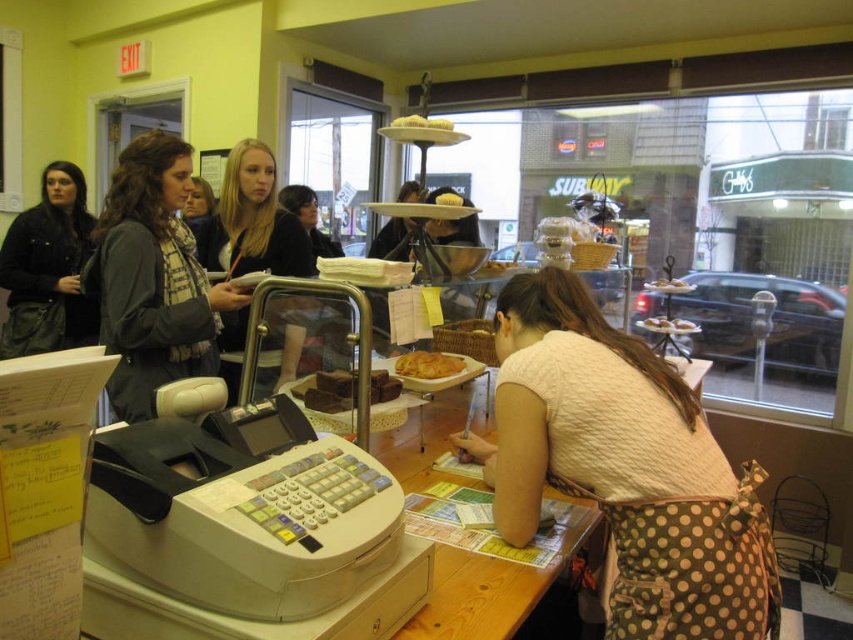
You are a customer standing at the checkout counter in the bakery scene. You notice two items hanging on a rack behind the counter. Which item is closer to your left side, the matte black jacket at left or the matte black scarf at center?

The matte black jacket at left is closer to your left side because it is positioned on the left side of the matte black scarf at center.

You are a customer at the bakery and want to pick up an item from the counter. The matte black jacket at left and the matte black scarf at center are in your way. Which object should you move first to clear the path?

The matte black scarf at center is behind the matte black jacket at left, so you should move the matte black jacket at left first to clear the path.

You are a customer at the bakery and want to buy the golden brown flaky pastry at center. However, there is a matte black scarf at center blocking your view of the pastry. Can you see the pastry clearly from where you are standing?

The matte black scarf at center is taller than the golden brown flaky pastry at center, so the scarf is blocking your view of the pastry.